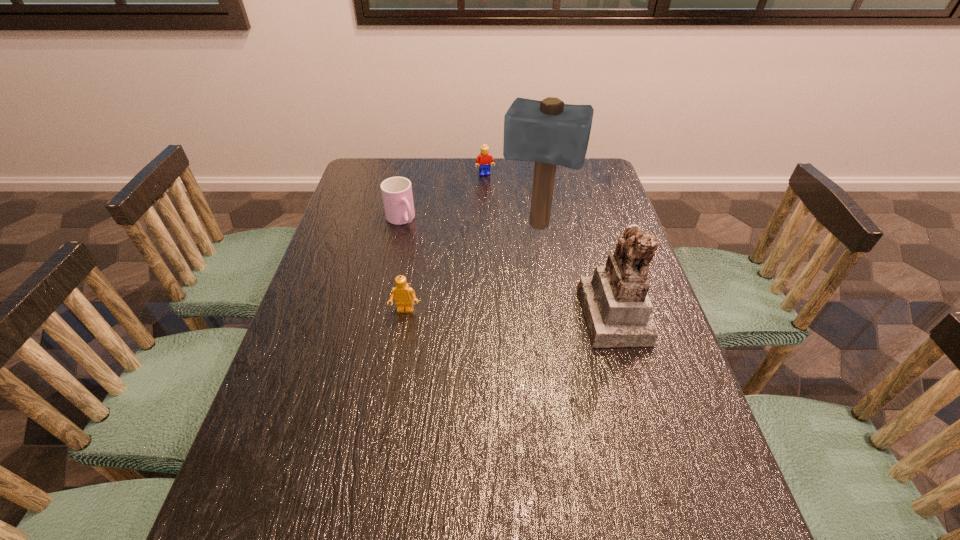
Where is `the left Lego`? The image size is (960, 540). the left Lego is located at coordinates (403, 293).

At what (x,y) coordinates should I click in order to perform the action: click on figurine. Please return your answer as a coordinate pair (x, y). Looking at the image, I should click on (617, 310).

In order to click on the right Lego in this screenshot , I will do `click(484, 157)`.

Find the location of `the third object from left to right`. the third object from left to right is located at coordinates (484, 157).

Identify the location of the tallest object. (548, 132).

Identify the location of cup. (397, 195).

Find the location of `vacant space positioned 0.340m on the face of the left Lego`. vacant space positioned 0.340m on the face of the left Lego is located at coordinates (383, 449).

In order to click on free space located 0.120m on the front-facing side of the third object from left to right in this screenshot , I will do `click(492, 195)`.

Image resolution: width=960 pixels, height=540 pixels. I want to click on vacant point located 0.130m on the front-facing side of the third object from left to right, so click(x=492, y=197).

Identify the location of vacant space situated on the front-facing side of the third object from left to right. The image size is (960, 540). (497, 217).